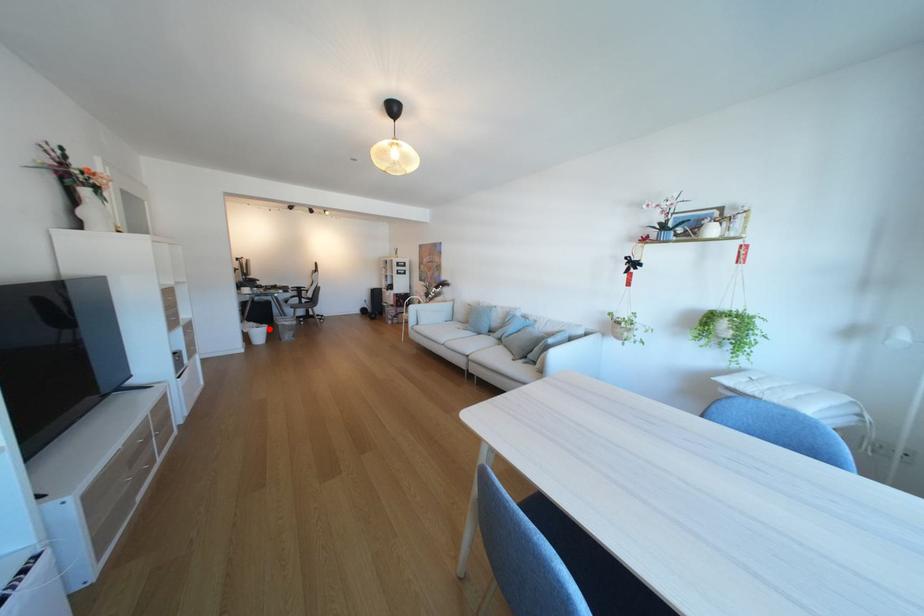
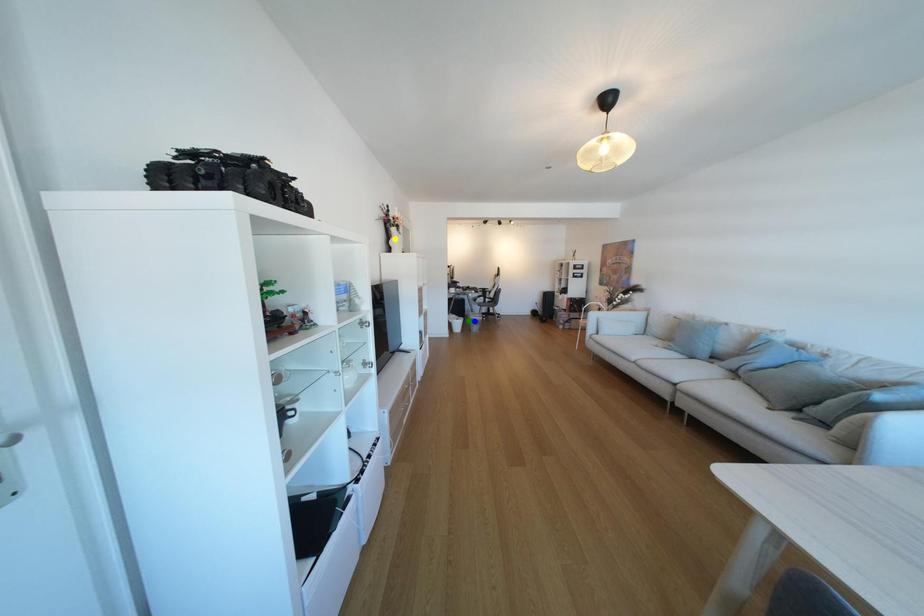
Question: I am providing you with two images of the same scene from different viewpoints. A red point is marked on the first image. You are given multiple points on the second image. Which mark in image 2 goes with the point in image 1?

Choices:
 (A) green point
 (B) yellow point
 (C) blue point

Answer: (A)